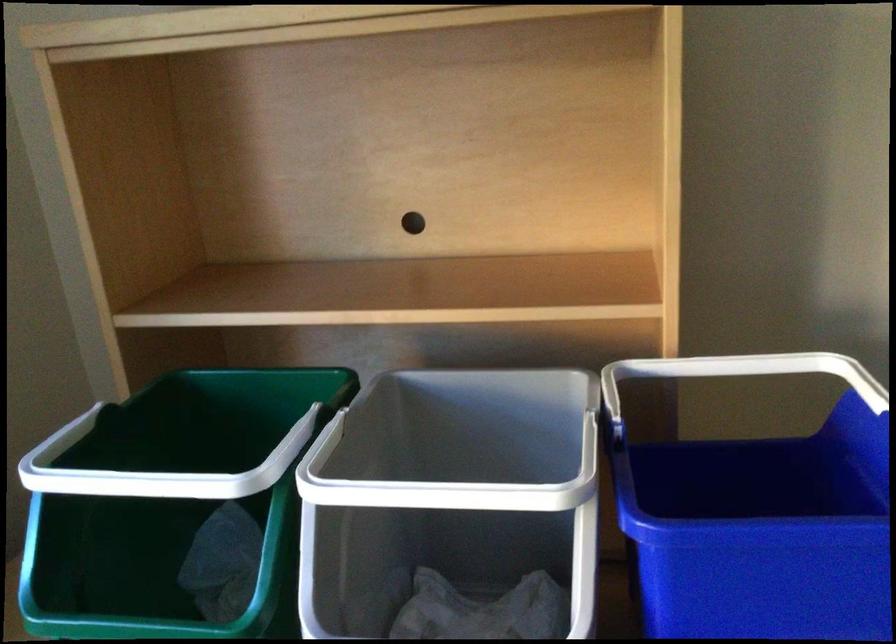
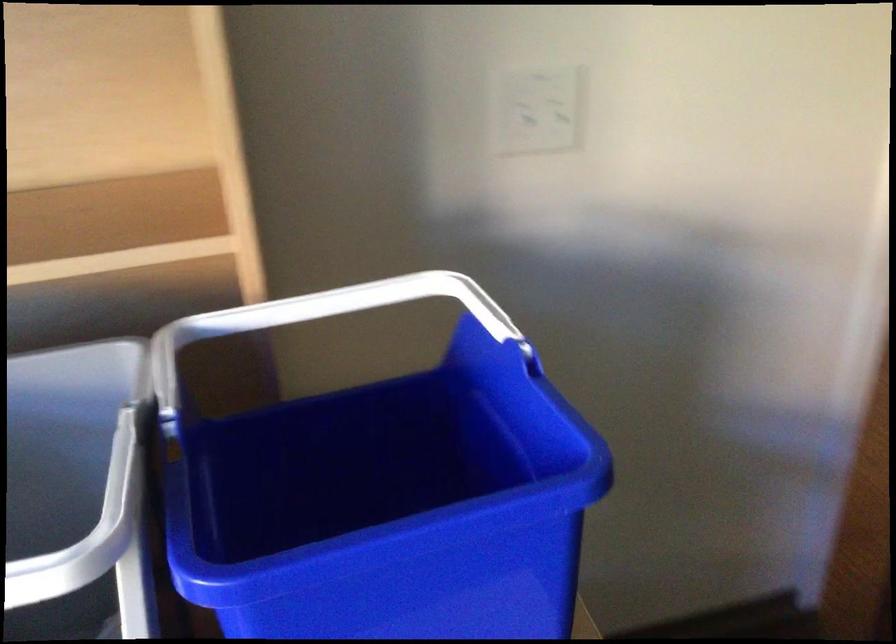
The point at (588, 474) is marked in the first image. Where is the corresponding point in the second image?

(125, 529)